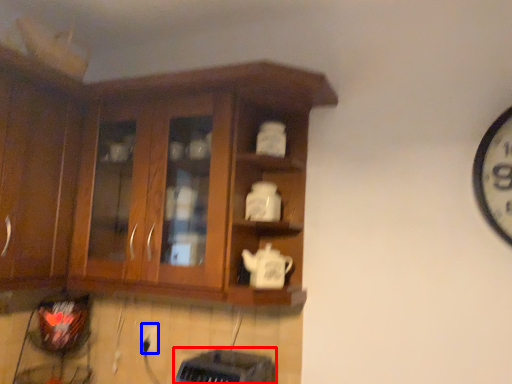
Question: Among these objects, which one is farthest to the camera, appliance (highlighted by a red box) or electric outlet (highlighted by a blue box)?

Choices:
 (A) appliance
 (B) electric outlet

Answer: (B)